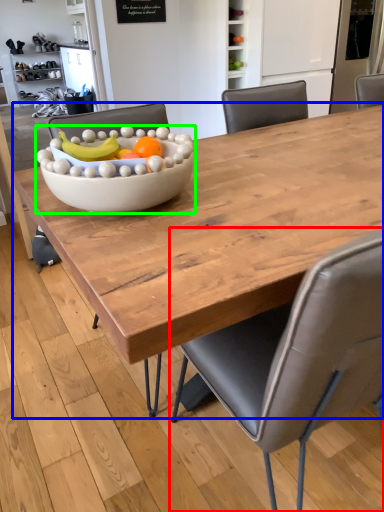
Question: Based on their relative distances, which object is farther from chair (highlighted by a red box)? Choose from coffee table (highlighted by a blue box) and bowl (highlighted by a green box).

Choices:
 (A) coffee table
 (B) bowl

Answer: (B)